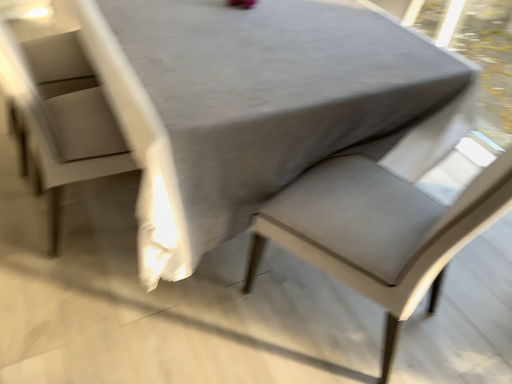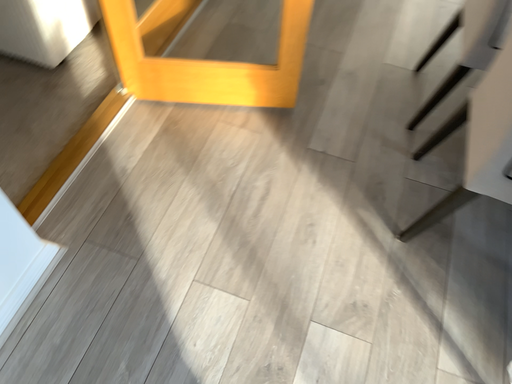
Question: How did the camera likely rotate when shooting the video?

Choices:
 (A) rotated left
 (B) rotated right

Answer: (A)